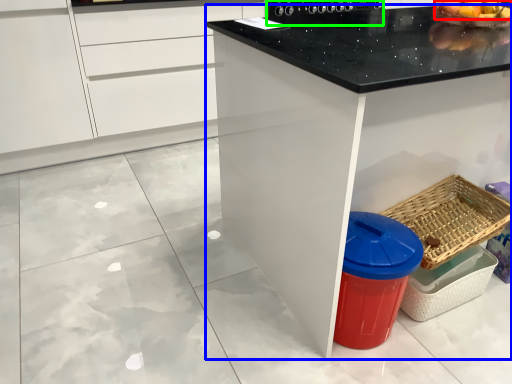
Question: Which object is the farthest from fruit (highlighted by a red box)? Choose among these: countertop (highlighted by a blue box) or appliance (highlighted by a green box).

Choices:
 (A) countertop
 (B) appliance

Answer: (A)